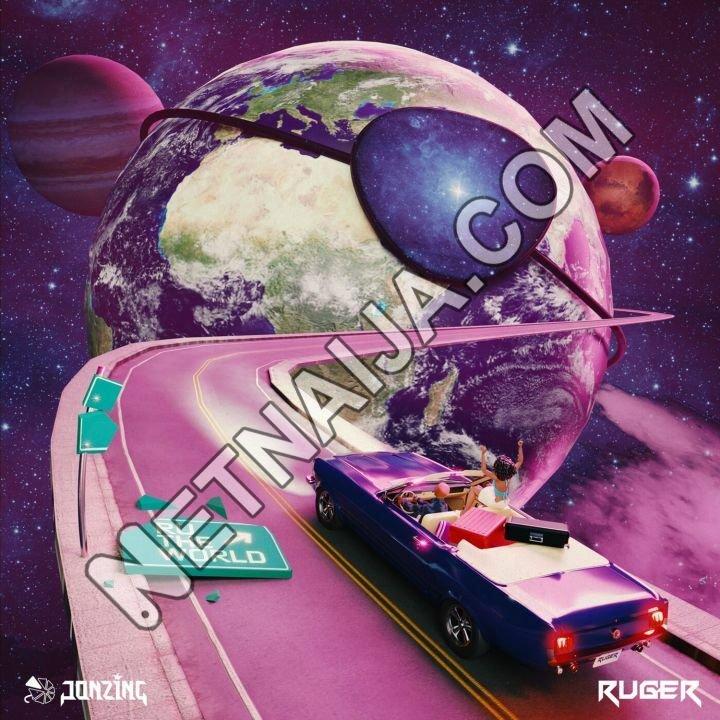
This screenshot has width=720, height=720. Identify the location of lights. (558, 642).